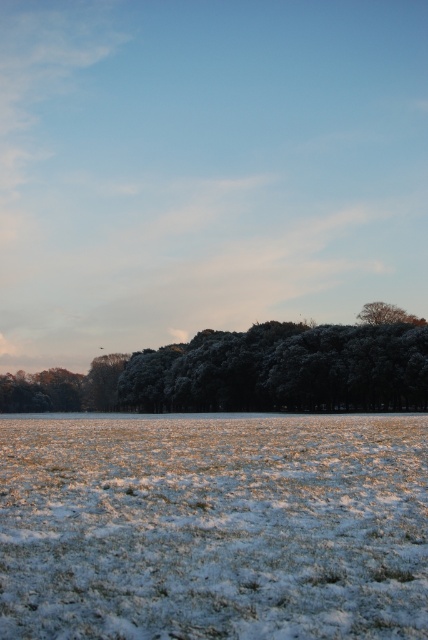
You are standing at the origin point of the coordinate system in the winter landscape image. You want to walk to the white frosty grass at center. Which direction should you move in terms of the coordinate system?

The white frosty grass at center is located at coordinate point 0.823 on the x axis and 0.498 on the y axis. Since you are at the origin point, you should move towards the positive x and positive y direction to reach it.

You are standing in the winter landscape described. There is a point at coordinates (213, 525). What is located at this point?

The point at coordinates (213, 525) is where the white frosty grass at center is located.